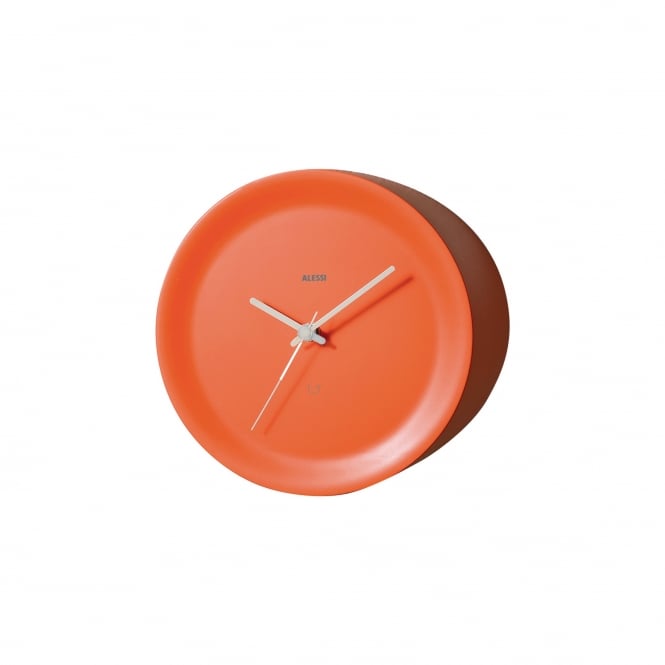
You are a GUI agent. You are given a task and a screenshot of the screen. Output one action in this format:
    pyautogui.click(x=<x>, y=<y>)
    Task: Click on the shadow from clock
    Image resolution: width=665 pixels, height=665 pixels.
    Given the screenshot: What is the action you would take?
    pyautogui.click(x=487, y=336)